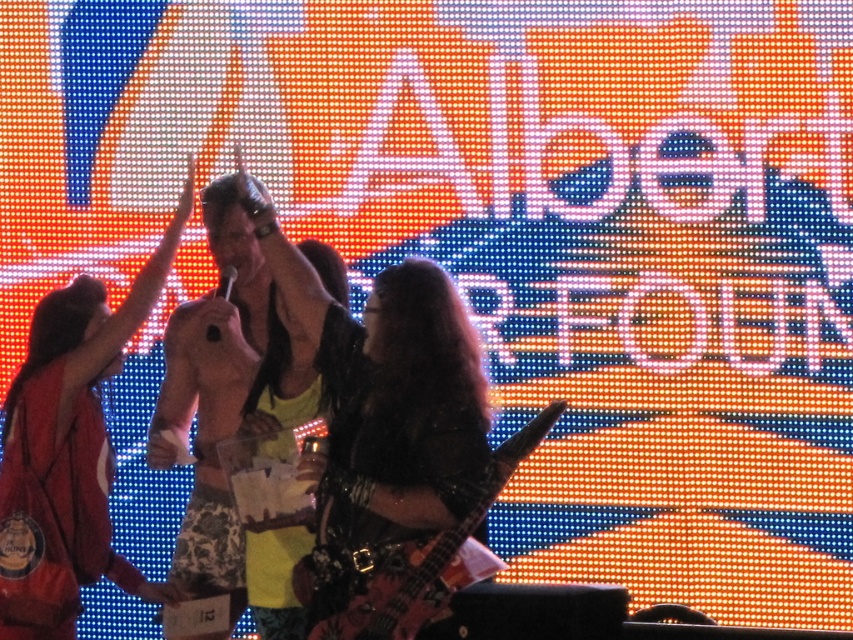
In the scene shown: Is shiny yellow tank top at center further to the viewer compared to wooden electric guitar at center?

That is True.

Does shiny yellow tank top at center have a lesser width compared to wooden electric guitar at center?

Yes.

Is point (251, 572) less distant than point (389, 616)?

No, (251, 572) is behind (389, 616).

The image size is (853, 640). Identify the location of shiny yellow tank top at center. coord(283,376).

Which of these two, shiny black dress at center or shiny yellow tank top at center, stands shorter?

Standing shorter between the two is shiny yellow tank top at center.

You are a GUI agent. You are given a task and a screenshot of the screen. Output one action in this format:
    pyautogui.click(x=<x>, y=<y>)
    Task: Click on the shiny black dress at center
    This screenshot has width=853, height=640.
    Given the screenshot: What is the action you would take?
    (x=78, y=413)

Can you confirm if shiny black dress at center is positioned to the left of wooden electric guitar at center?

Indeed, shiny black dress at center is positioned on the left side of wooden electric guitar at center.

Consider the image. Which of these two, shiny black dress at center or wooden electric guitar at center, stands taller?

shiny black dress at center

Between point (99, 314) and point (387, 628), which one is positioned behind?

Positioned behind is point (99, 314).

Where is `shiny black dress at center`? The width and height of the screenshot is (853, 640). shiny black dress at center is located at coordinates (78, 413).